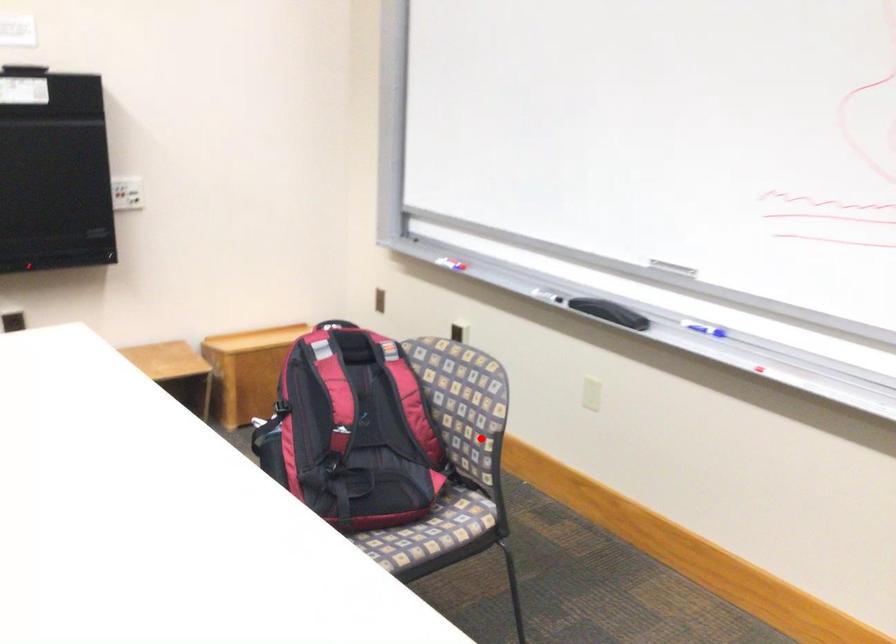
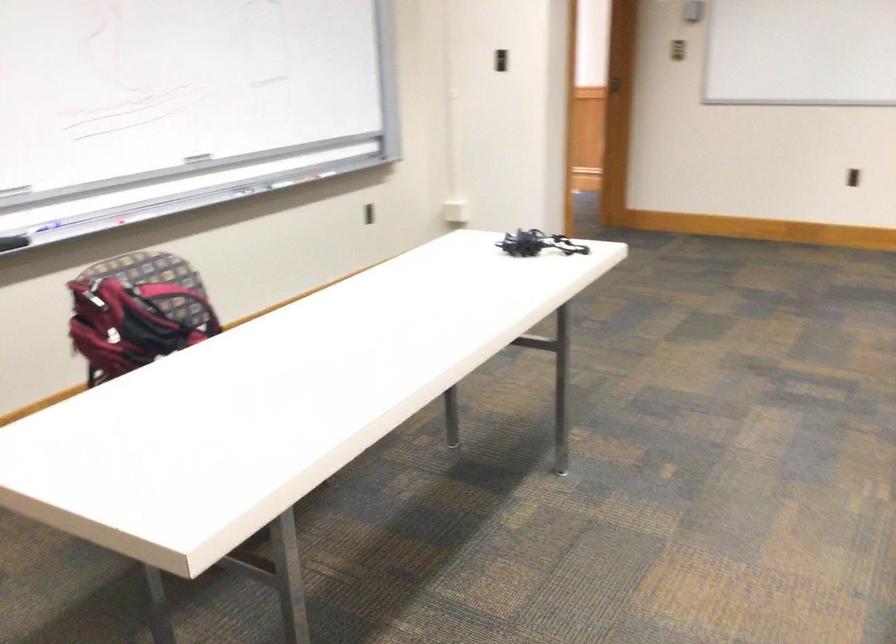
In the second image, find the point that corresponds to the highlighted location in the first image.

(177, 301)